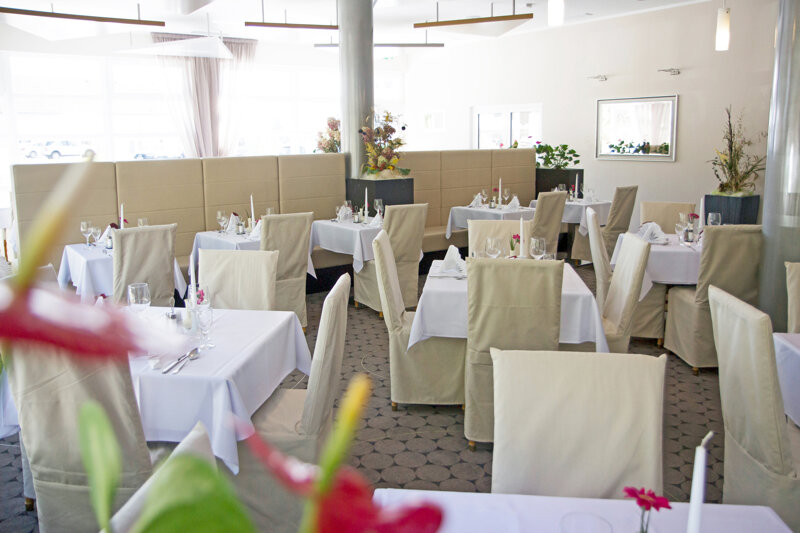
Find the location of `utensils`. utensils is located at coordinates (178, 368), (434, 280), (336, 221), (109, 251), (668, 238).